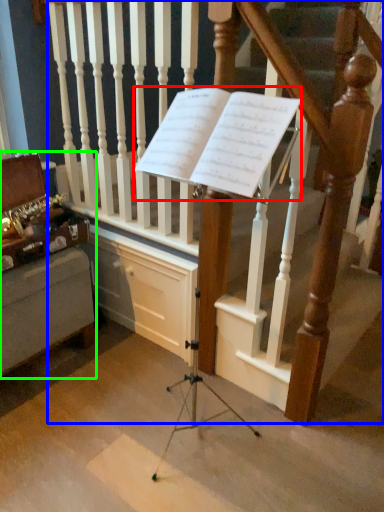
Question: Considering the real-world distances, which object is farthest from sheet music (highlighted by a red box)? stairs (highlighted by a blue box) or furniture (highlighted by a green box)?

Choices:
 (A) stairs
 (B) furniture

Answer: (B)